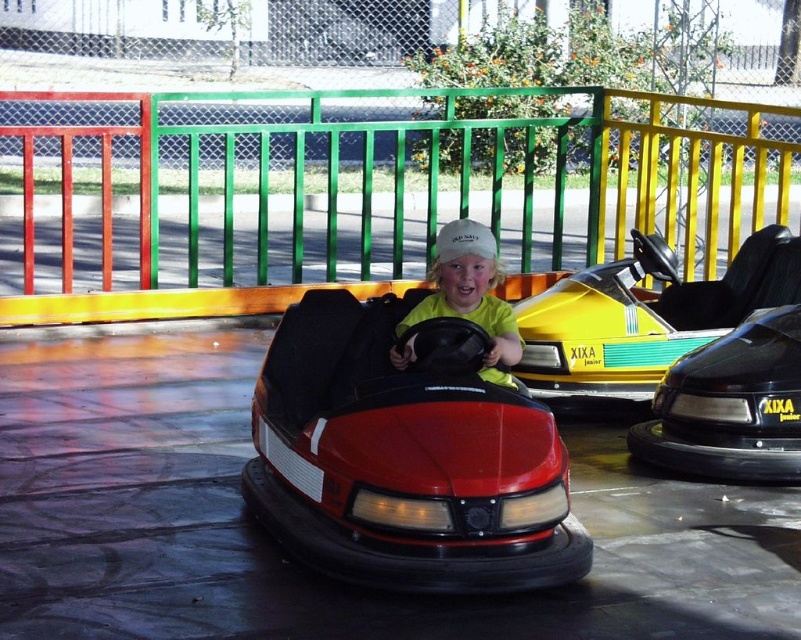
Identify the location of shiny red bumper car at center. pyautogui.click(x=405, y=456).

Is point (550, 582) less distant than point (564, 321)?

Yes, it is in front of point (564, 321).

In order to click on shiny red bumper car at center in this screenshot , I will do `click(405, 456)`.

Is point (681, 390) closer to camera compared to point (510, 340)?

That is False.

From the picture: Who is shorter, black glossy bumper car at right or yellow matte shirt at center?

Standing shorter between the two is yellow matte shirt at center.

Which is in front, point (694, 397) or point (465, 234)?

Positioned in front is point (465, 234).

Locate an element on the screen. The height and width of the screenshot is (640, 801). black glossy bumper car at right is located at coordinates (731, 404).

Between shiny red bumper car at center and yellow matte shirt at center, which one has less height?

yellow matte shirt at center is shorter.

Which is in front, point (489, 513) or point (493, 336)?

Point (489, 513) is in front.

Where is `shiny red bumper car at center`? Image resolution: width=801 pixels, height=640 pixels. shiny red bumper car at center is located at coordinates (405, 456).